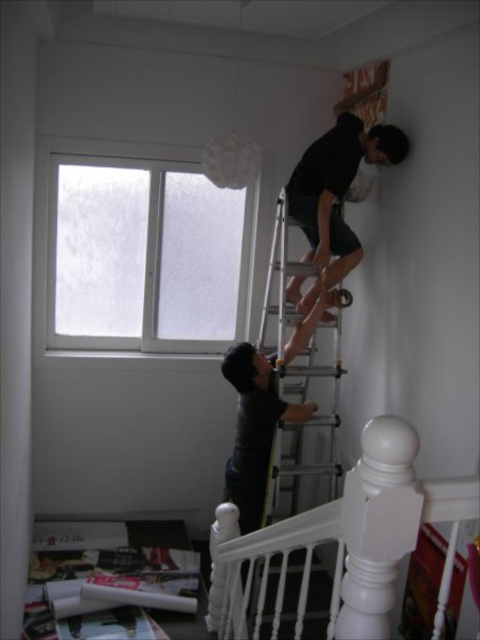
You are a painter who needs to place a ladder safely against the wall. You see the transparent glass window at upper left and the white glossy handrail at upper center. Which object should you avoid placing the ladder near to prevent it from hitting something?

You should avoid placing the ladder near the transparent glass window at upper left because it is closer to you than the white glossy handrail at upper center, so the ladder might hit the window if placed too close.

You are a visitor entering the room and need to walk from the door to the staircase railing in the foreground. There is a silver metallic ladder at upper center and a black matte shirt at upper right in your way. Which object should you avoid to reach the staircase railing safely?

The silver metallic ladder at upper center is positioned on the left side of black matte shirt at upper right. To reach the staircase railing safely, you should avoid the silver metallic ladder at upper center as it is closer to your path.

Based on the photo, you are standing at the base of the ladder in the room. You notice two points marked on the wall. The first point is at coordinates point(285, 216) and the second point is at point(354, 234). From your perspective, which point is closer to you?

Point(285, 216) is in front of point(354, 234), so the first point is closer to you.